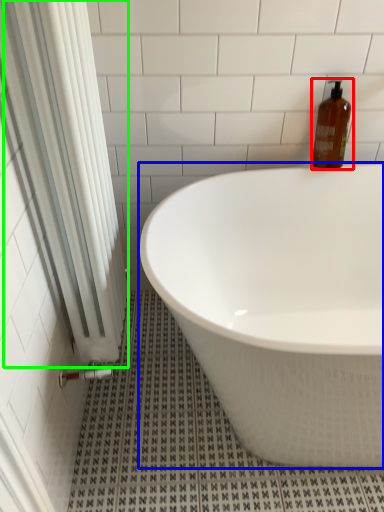
Question: Which is nearer to the bottle (highlighted by a red box)? bathtub (highlighted by a blue box) or shower curtain (highlighted by a green box).

Choices:
 (A) bathtub
 (B) shower curtain

Answer: (A)